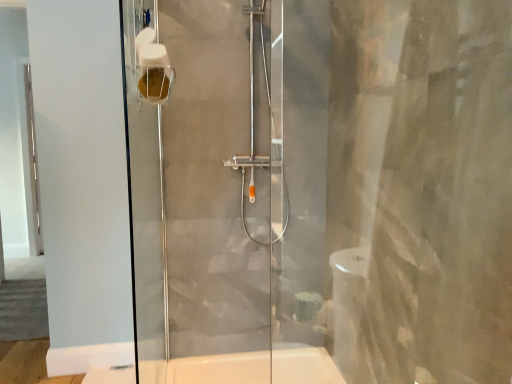
Question: Is satin chrome shower at center in front of or behind white matte toilet paper at upper left in the image?

Choices:
 (A) front
 (B) behind

Answer: (B)

Question: Considering the positions of point (275, 238) and point (139, 39), is point (275, 238) closer or farther from the camera than point (139, 39)?

Choices:
 (A) farther
 (B) closer

Answer: (A)

Question: From a real-world perspective, is satin chrome shower at center physically located above or below white matte toilet paper at upper left?

Choices:
 (A) above
 (B) below

Answer: (B)

Question: Looking at their shapes, would you say white matte toilet paper at upper left is wider or thinner than satin chrome shower at center?

Choices:
 (A) thin
 (B) wide

Answer: (A)

Question: Is white matte toilet paper at upper left inside the boundaries of satin chrome shower at center, or outside?

Choices:
 (A) outside
 (B) inside

Answer: (A)

Question: In terms of height, does white matte toilet paper at upper left look taller or shorter compared to satin chrome shower at center?

Choices:
 (A) tall
 (B) short

Answer: (B)

Question: From the image's perspective, is white matte toilet paper at upper left above or below satin chrome shower at center?

Choices:
 (A) above
 (B) below

Answer: (A)